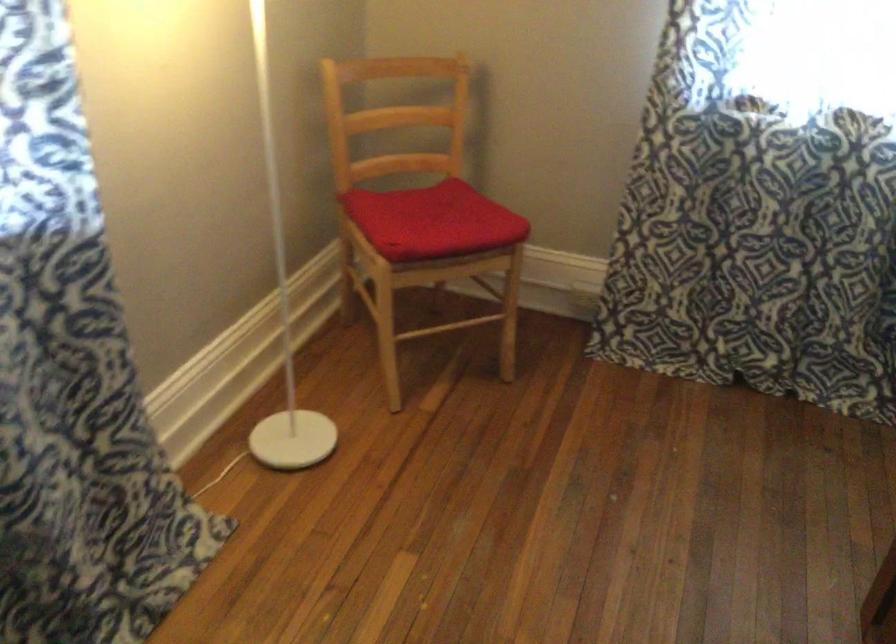
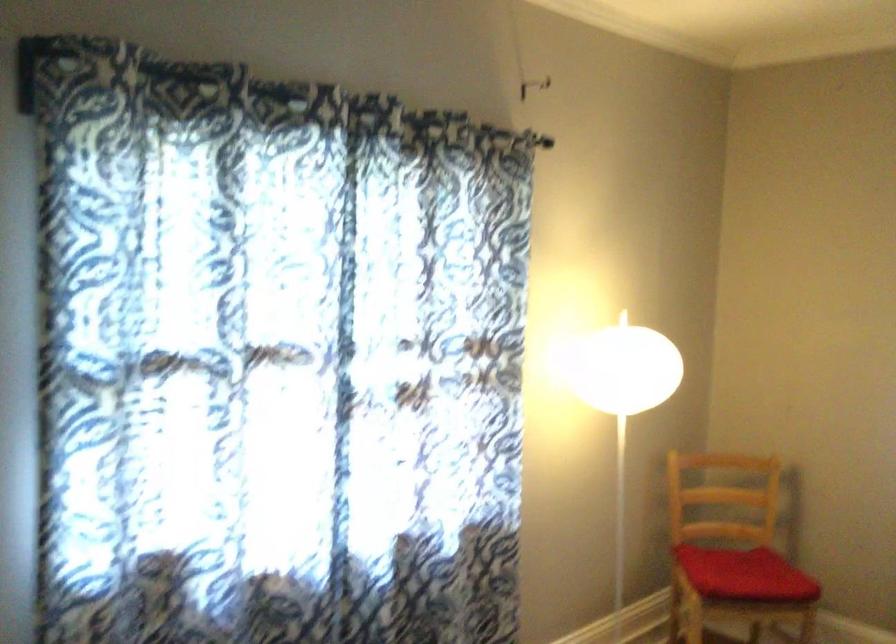
Find the pixel in the second image that matches point (436, 236) in the first image.

(745, 574)